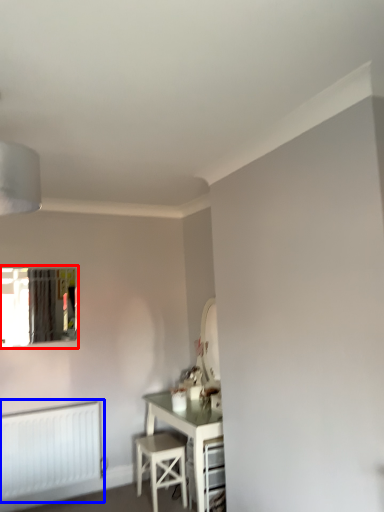
Question: Which object is closer to the camera taking this photo, window (highlighted by a red box) or radiator (highlighted by a blue box)?

Choices:
 (A) window
 (B) radiator

Answer: (B)